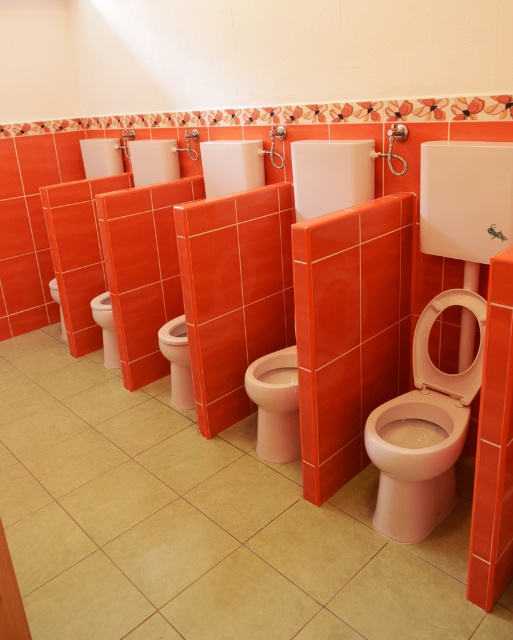
Question: Does white glossy toilet at lower right appear on the left side of matte white toilet at center?

Choices:
 (A) no
 (B) yes

Answer: (A)

Question: Which object is farther from the camera taking this photo?

Choices:
 (A) white glossy toilet bowl at center
 (B) white glossy toilet at lower right
 (C) white glossy toilet bowl at lower left

Answer: (C)

Question: Does white glossy toilet at lower right appear over matte white toilet at center?

Choices:
 (A) no
 (B) yes

Answer: (A)

Question: Which point appears closest to the camera in this image?

Choices:
 (A) (389, 465)
 (B) (252, 396)
 (C) (177, 390)
 (D) (93, 300)

Answer: (A)

Question: Is matte white toilet at center wider than white glossy toilet bowl at center?

Choices:
 (A) yes
 (B) no

Answer: (A)

Question: Among these objects, which one is farthest from the camera?

Choices:
 (A) white glossy toilet at lower right
 (B) white glossy toilet bowl at center

Answer: (B)